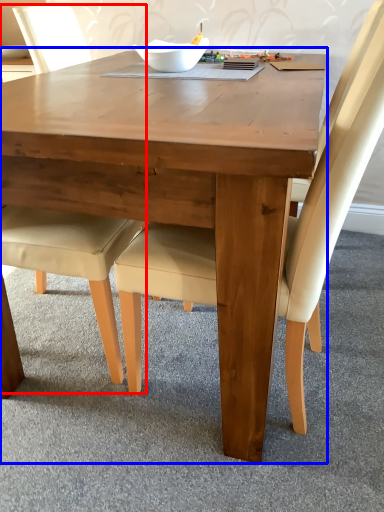
Question: Which of the following is the farthest to the observer, chair (highlighted by a red box) or coffee table (highlighted by a blue box)?

Choices:
 (A) chair
 (B) coffee table

Answer: (A)